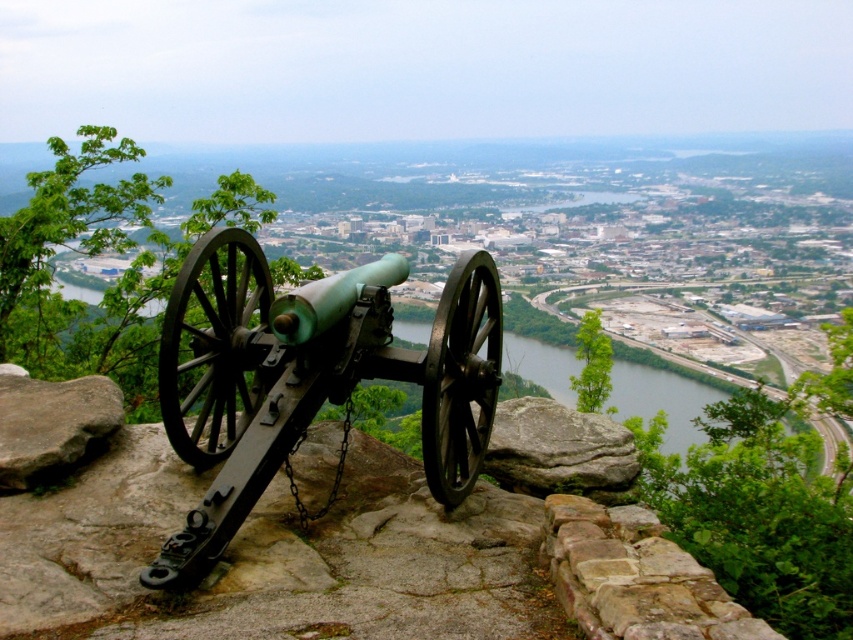
Question: Is green matte cannon at center in front of greenish-gray water at center?

Choices:
 (A) yes
 (B) no

Answer: (A)

Question: Is the position of green matte cannon at center more distant than that of greenish-gray water at center?

Choices:
 (A) yes
 (B) no

Answer: (B)

Question: Among these points, which one is farthest from the camera?

Choices:
 (A) (270, 321)
 (B) (514, 356)

Answer: (B)

Question: Is green matte cannon at center positioned before greenish-gray water at center?

Choices:
 (A) no
 (B) yes

Answer: (B)

Question: Which object appears farthest from the camera in this image?

Choices:
 (A) greenish-gray water at center
 (B) green matte cannon at center

Answer: (A)

Question: Which point appears closest to the camera in this image?

Choices:
 (A) (631, 368)
 (B) (473, 452)

Answer: (B)